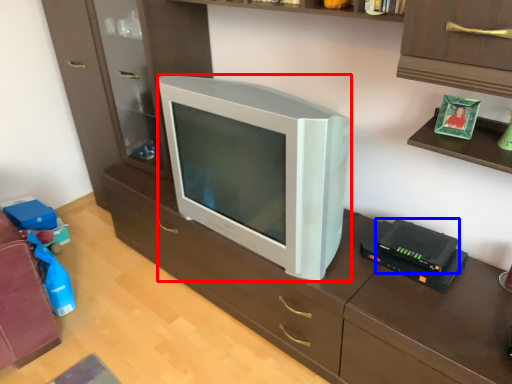
Question: Which of the following is the farthest to the observer, television (highlighted by a red box) or gadget (highlighted by a blue box)?

Choices:
 (A) television
 (B) gadget

Answer: (B)